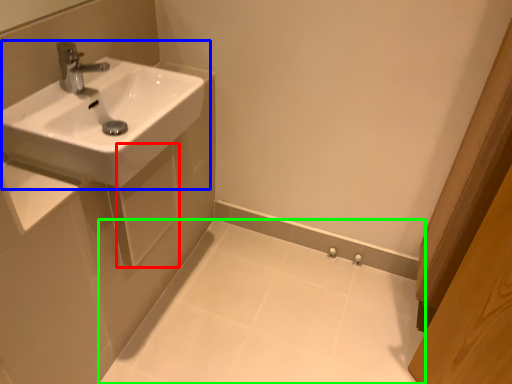
Question: Which object is the farthest from square (highlighted by a red box)? Choose among these: sink (highlighted by a blue box) or porcelain (highlighted by a green box).

Choices:
 (A) sink
 (B) porcelain

Answer: (B)